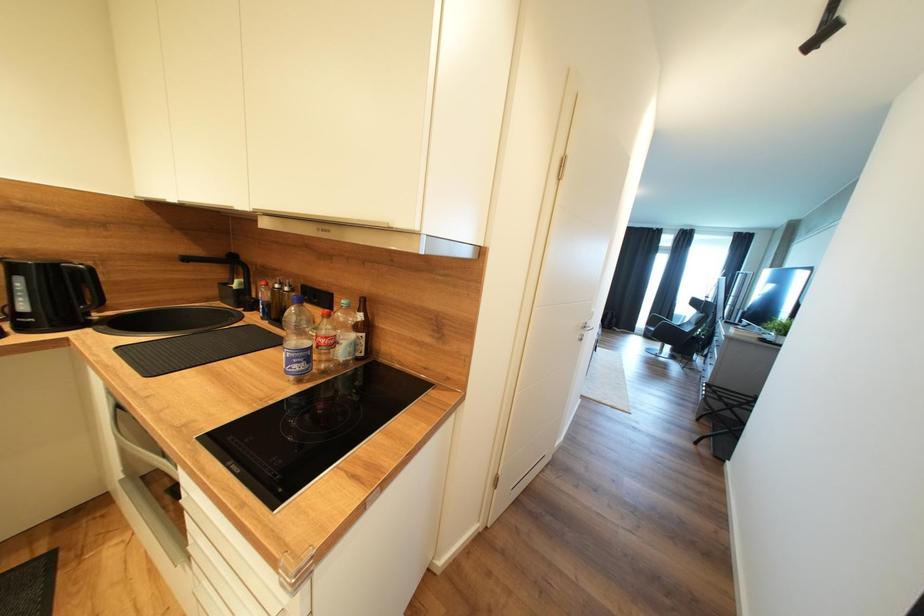
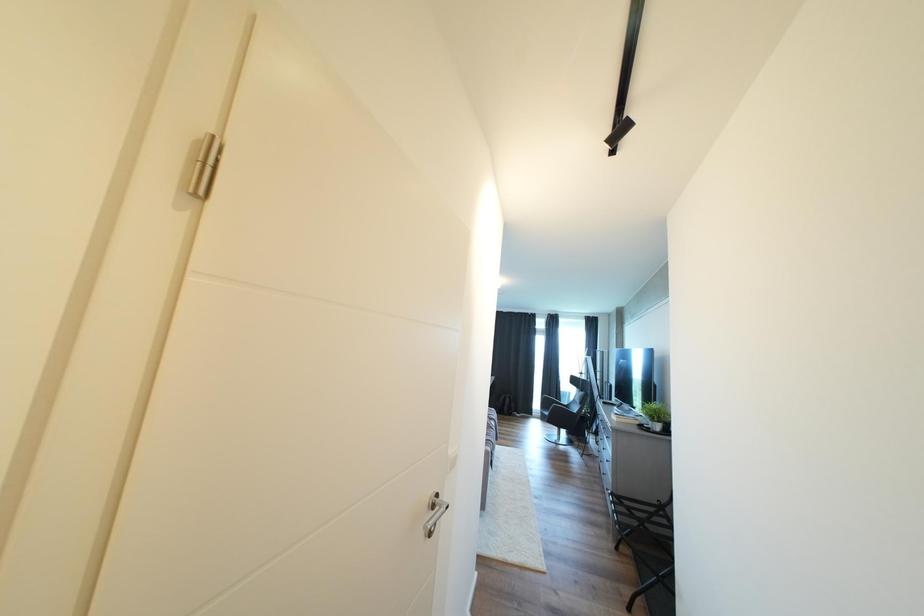
First-person continuous shooting, in which direction is the camera rotating?

The camera's rotation is toward right-up.